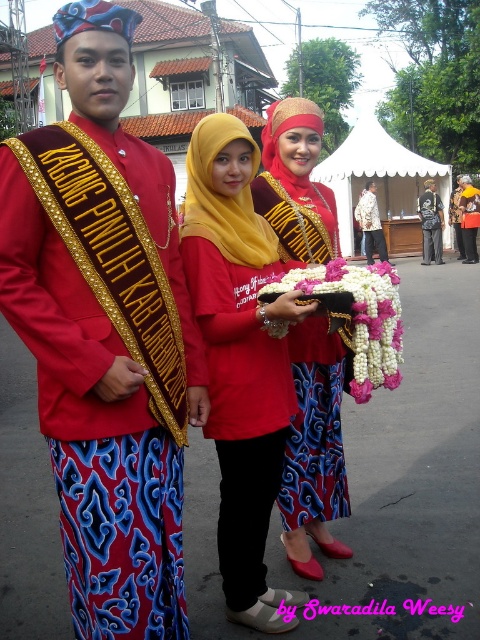
Which is below, matte yellow hijab at center or patterned fabric dress at center?

Positioned lower is matte yellow hijab at center.

Between point (222, 504) and point (466, 221), which one is positioned behind?

The point (466, 221) is more distant.

Between point (264, 460) and point (468, 253), which one is positioned behind?

The point (468, 253) is behind.

Find the location of a particular element. This screenshot has width=480, height=640. matte yellow hijab at center is located at coordinates (240, 358).

Between matte yellow hijab at center and matte red dress at center, which one is positioned lower?

Positioned lower is matte red dress at center.

Who is more forward, (291, 266) or (302, 170)?

Point (291, 266)

Is point (212, 193) positioned before point (290, 141)?

Yes, point (212, 193) is in front of point (290, 141).

Locate an element on the screen. The image size is (480, 640). matte yellow hijab at center is located at coordinates (240, 358).

Does red satin sash at center have a greater width compared to matte gold sash at center?

No.

Between point (163, 385) and point (371, 257), which one is positioned in front?

Point (163, 385)

At what (x,y) coordinates should I click in order to perform the action: click on red satin sash at center. Please return your answer as a coordinate pair (x, y). The height and width of the screenshot is (640, 480). Looking at the image, I should click on (106, 365).